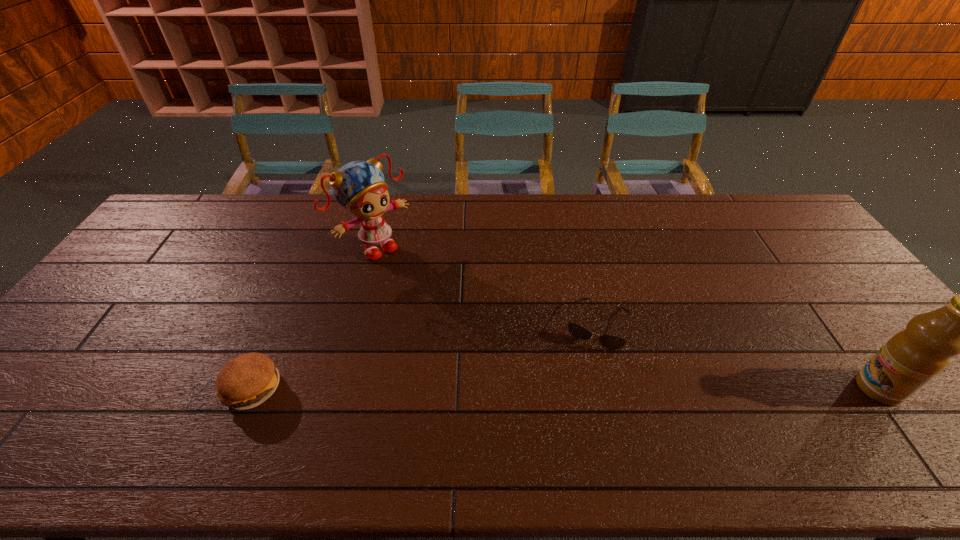
What are the coordinates of `free space between the olive oil and the sunglasses` in the screenshot? It's located at (737, 356).

Find the location of a particular element. free space that is in between the olive oil and the third nearest object is located at coordinates (737, 356).

Locate an element on the screen. This screenshot has width=960, height=540. vacant space in between the shortest object and the olive oil is located at coordinates (737, 356).

The height and width of the screenshot is (540, 960). Find the location of `free space between the rightmost object and the hamburger`. free space between the rightmost object and the hamburger is located at coordinates (565, 388).

Where is `free area in between the farthest object and the olive oil`? The width and height of the screenshot is (960, 540). free area in between the farthest object and the olive oil is located at coordinates (627, 318).

Identify the location of object that is the second closest to the rightmost object. This screenshot has width=960, height=540. [359, 186].

Where is `object that is the nearest to the second object from left to right`? object that is the nearest to the second object from left to right is located at coordinates (245, 382).

Locate an element on the screen. This screenshot has height=540, width=960. free space that satisfies the following two spatial constraints: 1. on the front side of the doll; 2. on the left side of the shortest object is located at coordinates point(354,323).

Locate an element on the screen. This screenshot has height=540, width=960. vacant point that satisfies the following two spatial constraints: 1. on the front side of the olive oil; 2. on the label of the second object from right to left is located at coordinates (612, 388).

Identify the location of vacant point that satisfies the following two spatial constraints: 1. on the front side of the hamburger; 2. on the label of the olive oil. The image size is (960, 540). (253, 388).